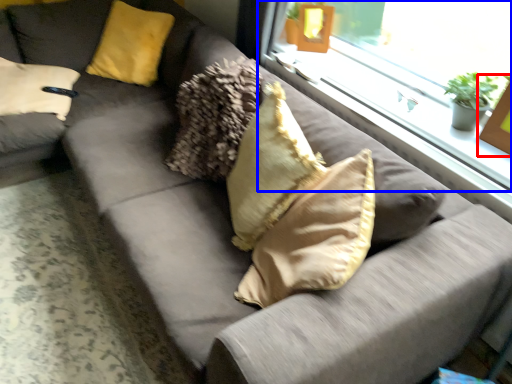
Question: Which object is further to the camera taking this photo, picture frame (highlighted by a red box) or window (highlighted by a blue box)?

Choices:
 (A) picture frame
 (B) window

Answer: (B)